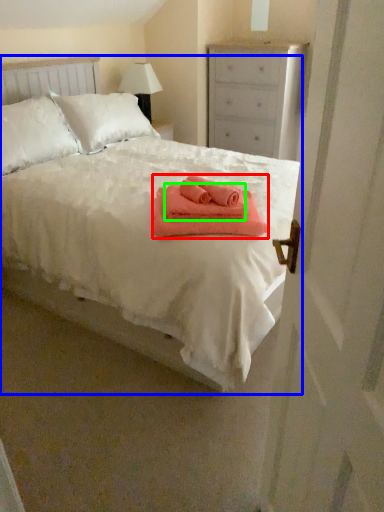
Question: Which object is positioned farthest from bath towel (highlighted by a red box)? Select from bed (highlighted by a blue box) and bath towel (highlighted by a green box).

Choices:
 (A) bed
 (B) bath towel

Answer: (A)